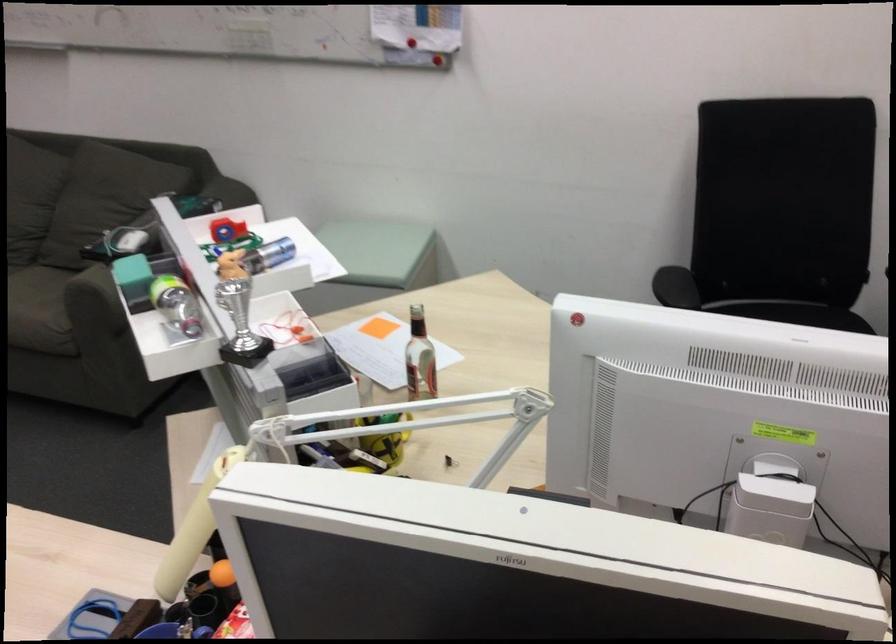
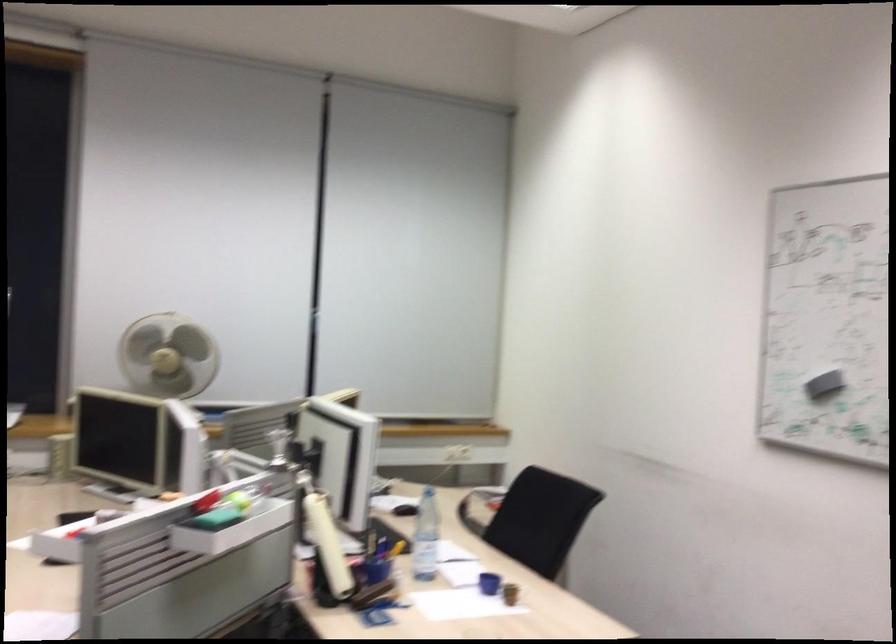
In the second image, find the point that corresponds to (176,560) in the first image.

(328, 545)